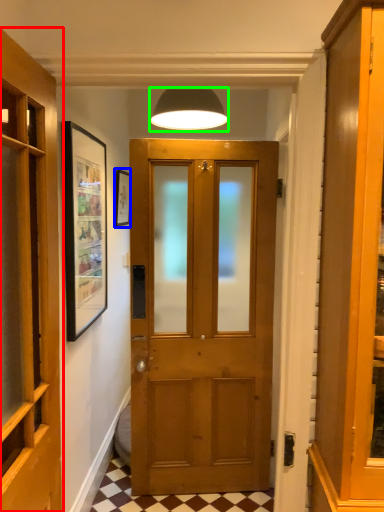
Question: Estimate the real-world distances between objects in this image. Which object is closer to door (highlighted by a red box), picture frame (highlighted by a blue box) or lamp (highlighted by a green box)?

Choices:
 (A) picture frame
 (B) lamp

Answer: (B)